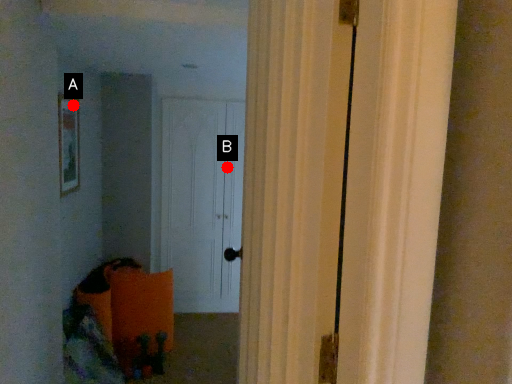
Question: Two points are circled on the image, labeled by A and B beside each circle. Which point is farther to the camera?

Choices:
 (A) A is further
 (B) B is further

Answer: (B)